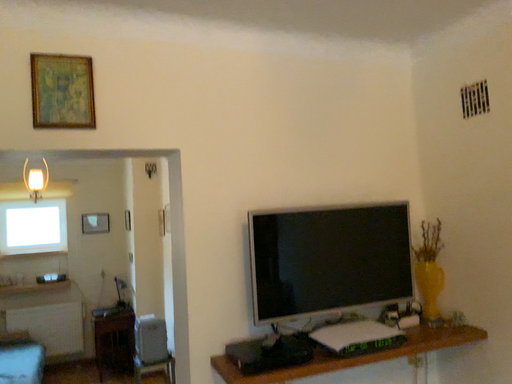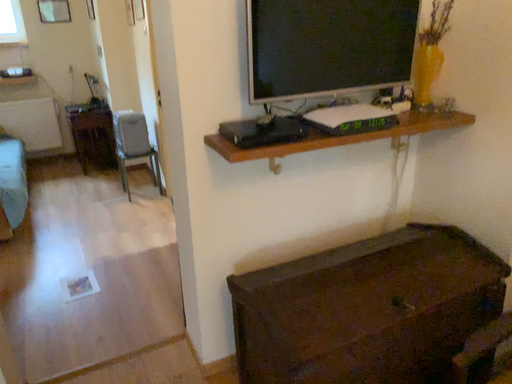
Question: Which way did the camera rotate in the video?

Choices:
 (A) rotated downward
 (B) rotated upward

Answer: (A)